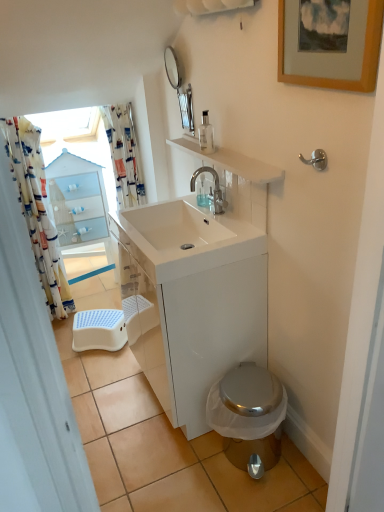
Question: In the image, is blue plastic step stool at lower left on the left side or the right side of printed fabric shower curtain at left, the 2th shower curtain in the right-to-left sequence?

Choices:
 (A) left
 (B) right

Answer: (B)

Question: From a real-world perspective, is blue plastic step stool at lower left positioned above or below printed fabric shower curtain at left, the 2th shower curtain in the right-to-left sequence?

Choices:
 (A) below
 (B) above

Answer: (A)

Question: Estimate the real-world distances between objects in this image. Which object is farther from the wooden picture frame at upper right?

Choices:
 (A) shiny metallic toilet at lower right
 (B) white glossy cabinet at center
 (C) satin nickel hook at upper right
 (D) blue plastic step stool at lower left
 (E) clear glass soap dispenser at upper center, the second soap dispenser when ordered from back to front

Answer: (D)

Question: Which object is positioned closest to the printed fabric shower curtain at upper left, the first shower curtain from the right?

Choices:
 (A) printed fabric shower curtain at left, the 2th shower curtain in the right-to-left sequence
 (B) wooden picture frame at upper right
 (C) clear plastic soap dispenser at upper center, which is the 2th soap dispenser from top to bottom
 (D) clear glass soap dispenser at upper center, marked as the 1th soap dispenser in a front-to-back arrangement
 (E) satin nickel hook at upper right

Answer: (A)